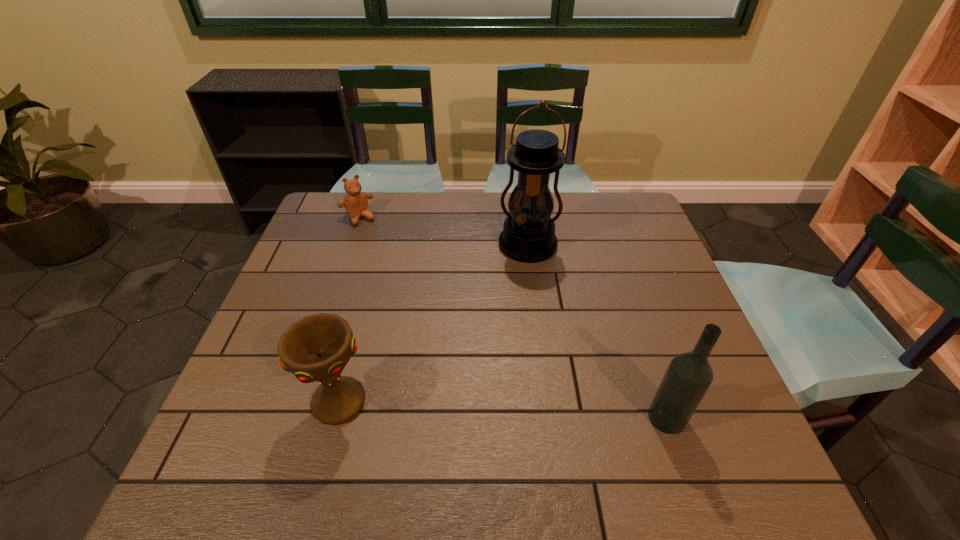
What are the coordinates of `free location that satisfies the following two spatial constraints: 1. on the front side of the third tallest object; 2. on the left side of the shortest object` in the screenshot? It's located at [295, 402].